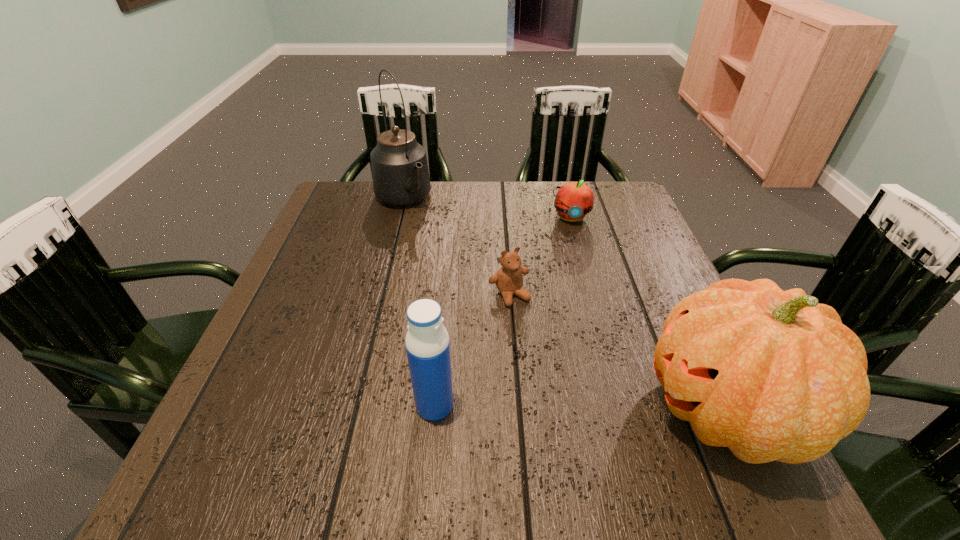
Identify the location of free space that satisfies the following two spatial constraints: 1. on the front side of the apple; 2. on the carved face of the pumpkin. (623, 409).

This screenshot has height=540, width=960. Identify the location of free spot that satisfies the following two spatial constraints: 1. on the front side of the second tallest object; 2. on the carved face of the tallest object. (350, 409).